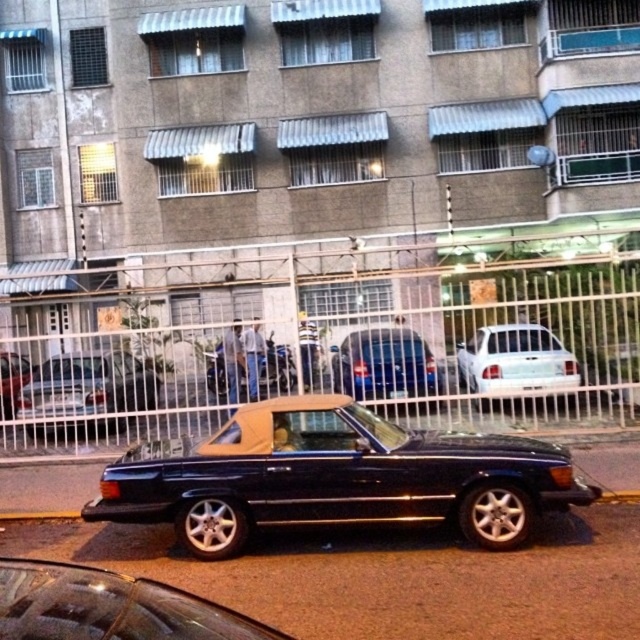
Question: Which object is the farthest from the white matte sedan at center?

Choices:
 (A) shiny silver car at center
 (B) shiny black convertible at lower left
 (C) shiny black convertible at center
 (D) shiny silver convertible at center

Answer: (B)

Question: Which object is positioned closest to the metallic blue sedan at center?

Choices:
 (A) shiny black convertible at center
 (B) black plastic license plate at center
 (C) metallic silver fence at center

Answer: (C)

Question: Can you confirm if metallic silver fence at center is positioned above white matte sedan at center?

Choices:
 (A) yes
 (B) no

Answer: (A)

Question: Considering the relative positions of shiny silver convertible at center and black plastic license plate at center in the image provided, where is shiny silver convertible at center located with respect to black plastic license plate at center?

Choices:
 (A) right
 (B) left

Answer: (B)

Question: Based on their relative distances, which object is farther from the white matte sedan at center?

Choices:
 (A) shiny black convertible at lower left
 (B) metallic blue sedan at center
 (C) black plastic license plate at center

Answer: (A)

Question: Is shiny black convertible at center smaller than blue metallic van at center?

Choices:
 (A) yes
 (B) no

Answer: (B)